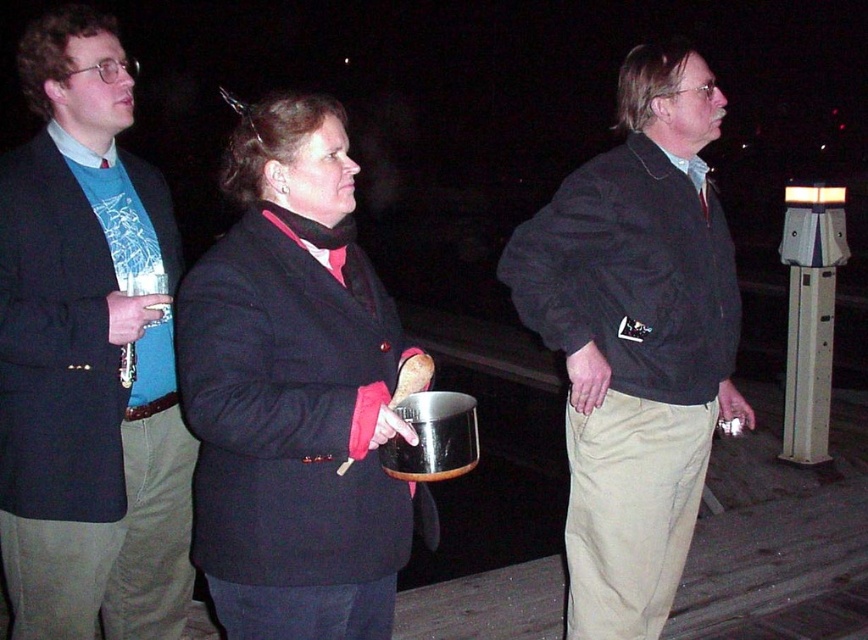
Does brushed metal flute at left have a greater width compared to khaki pants at center?

No.

Measure the distance between brushed metal flute at left and khaki pants at center.

brushed metal flute at left and khaki pants at center are 1.15 meters apart.

Locate an element on the screen. brushed metal flute at left is located at coordinates (87, 356).

Based on the photo, is brushed metal flute at left to the right of matte black coat at center from the viewer's perspective?

In fact, brushed metal flute at left is to the left of matte black coat at center.

Can you confirm if brushed metal flute at left is smaller than matte black coat at center?

Yes, brushed metal flute at left is smaller than matte black coat at center.

Locate an element on the screen. This screenshot has height=640, width=868. brushed metal flute at left is located at coordinates click(87, 356).

Identify the location of brushed metal flute at left. This screenshot has width=868, height=640. (87, 356).

Can you confirm if matte black coat at center is wider than khaki pants at center?

No, matte black coat at center is not wider than khaki pants at center.

Does matte black coat at center have a greater height compared to khaki pants at center?

No, matte black coat at center is not taller than khaki pants at center.

Is point (206, 456) farther from camera compared to point (676, 240)?

No, it is not.

You are a GUI agent. You are given a task and a screenshot of the screen. Output one action in this format:
    pyautogui.click(x=<x>, y=<y>)
    Task: Click on the matte black coat at center
    Image resolution: width=868 pixels, height=640 pixels.
    Given the screenshot: What is the action you would take?
    pyautogui.click(x=293, y=392)